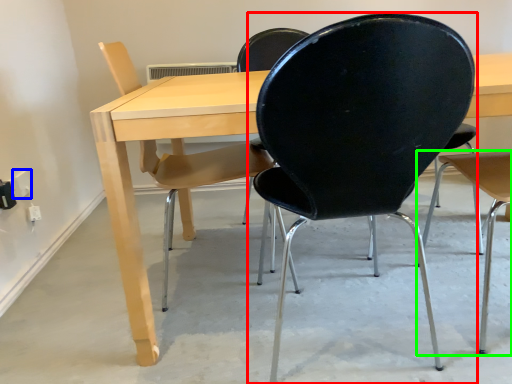
Question: Which object is positioned farthest from chair (highlighted by a red box)? Select from electric outlet (highlighted by a blue box) and chair (highlighted by a green box).

Choices:
 (A) electric outlet
 (B) chair

Answer: (A)